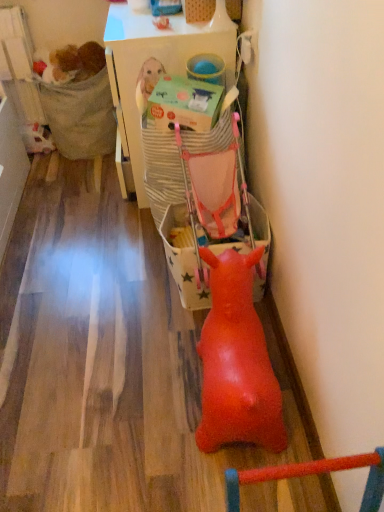
Where is `free space in front of textured fabric chair at left`? The image size is (384, 512). free space in front of textured fabric chair at left is located at coordinates (75, 180).